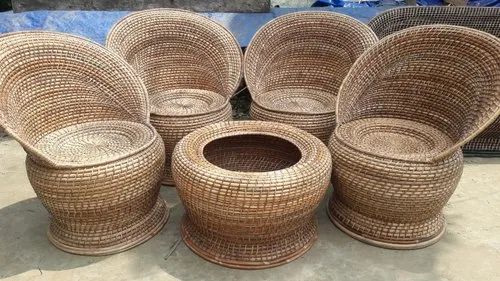
Identify the location of second from left chair seat. (176, 102).